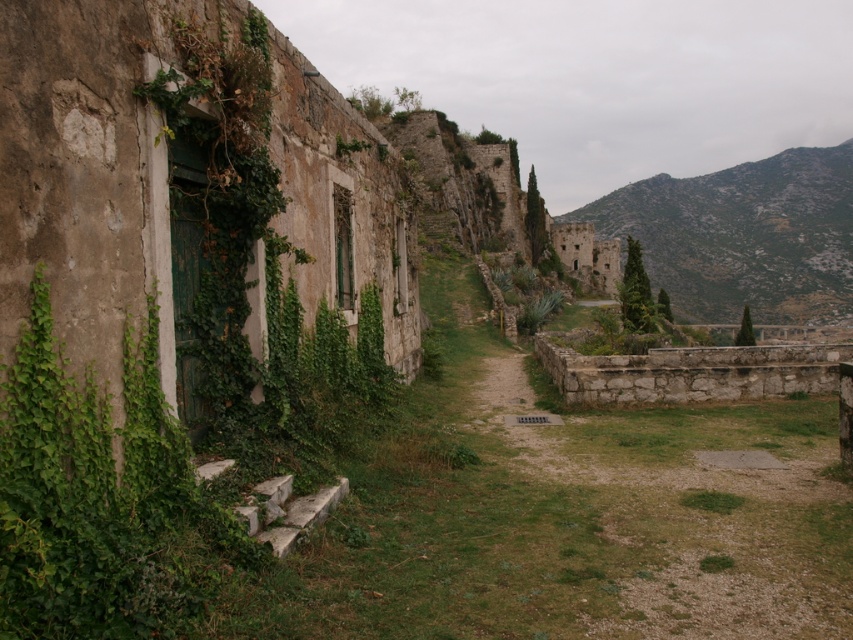
Question: Does green ivy at left have a larger size compared to green leafy bush at upper right?

Choices:
 (A) yes
 (B) no

Answer: (B)

Question: Considering the relative positions of rugged stone hillside at upper right and green leafy bush at upper right in the image provided, where is rugged stone hillside at upper right located with respect to green leafy bush at upper right?

Choices:
 (A) above
 (B) below

Answer: (A)

Question: Which of the following is the closest to the observer?

Choices:
 (A) (744, 323)
 (B) (68, 614)
 (C) (825, 259)

Answer: (B)

Question: Which object is closer to the camera taking this photo?

Choices:
 (A) rugged stone hillside at upper right
 (B) green leafy bush at upper right
 (C) green ivy at left

Answer: (C)

Question: Where is green ivy at left located in relation to green leafy bush at upper right in the image?

Choices:
 (A) below
 (B) above

Answer: (A)

Question: Which point appears farthest from the camera in this image?

Choices:
 (A) (695, 243)
 (B) (28, 333)

Answer: (A)